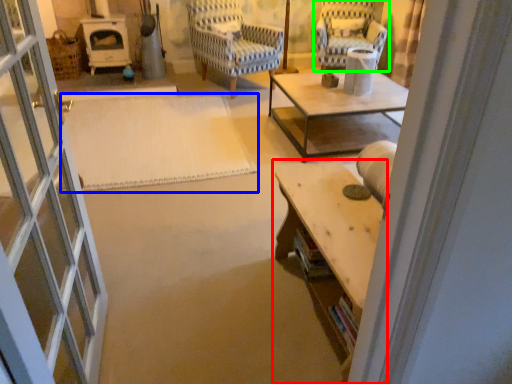
Question: Based on their relative distances, which object is nearer to table (highlighted by a red box)? Choose from mat (highlighted by a blue box) and chair (highlighted by a green box).

Choices:
 (A) mat
 (B) chair

Answer: (A)